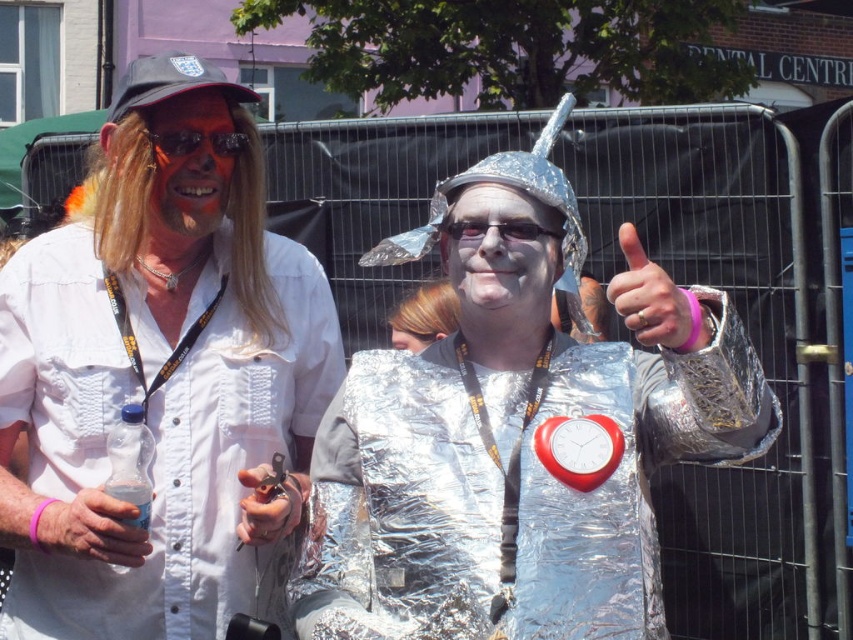
Measure the distance between matte white shirt at center and white foil face at center.

A distance of 5.07 feet exists between matte white shirt at center and white foil face at center.

Does matte white shirt at center have a greater width compared to white foil face at center?

Yes.

You are a GUI agent. You are given a task and a screenshot of the screen. Output one action in this format:
    pyautogui.click(x=<x>, y=<y>)
    Task: Click on the matte white shirt at center
    The width and height of the screenshot is (853, 640).
    Given the screenshot: What is the action you would take?
    pyautogui.click(x=158, y=364)

Who is lower down, shiny metallic suit at center or metallic silver keychain at center?

metallic silver keychain at center

Can you confirm if shiny metallic suit at center is positioned to the left of metallic silver keychain at center?

In fact, shiny metallic suit at center is to the right of metallic silver keychain at center.

You are a GUI agent. You are given a task and a screenshot of the screen. Output one action in this format:
    pyautogui.click(x=<x>, y=<y>)
    Task: Click on the shiny metallic suit at center
    This screenshot has width=853, height=640.
    Given the screenshot: What is the action you would take?
    pyautogui.click(x=509, y=444)

Is white foil face at center taller than metallic silver keychain at center?

Indeed, white foil face at center has a greater height compared to metallic silver keychain at center.

Does white foil face at center appear on the right side of metallic silver keychain at center?

Indeed, white foil face at center is positioned on the right side of metallic silver keychain at center.

Locate an element on the screen. This screenshot has width=853, height=640. white foil face at center is located at coordinates (502, 256).